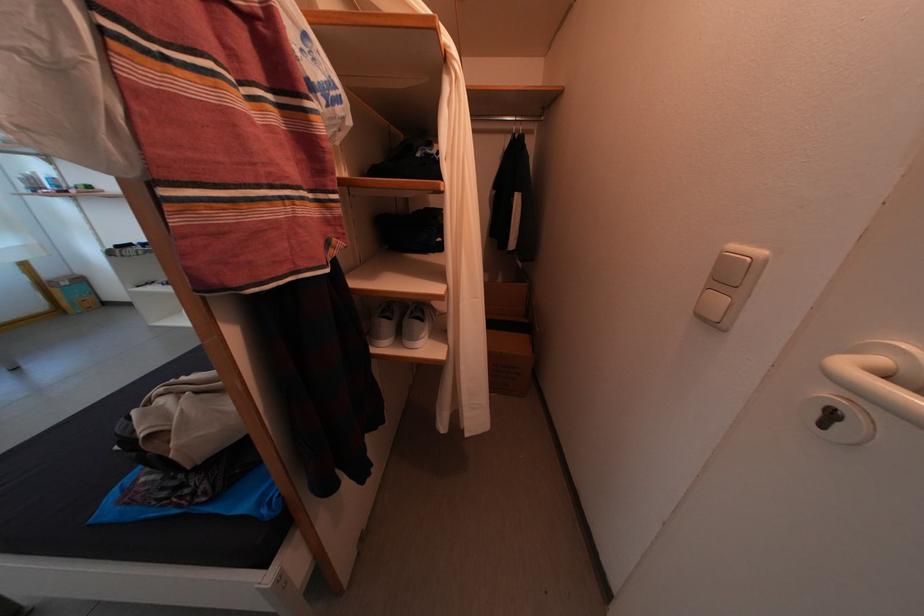
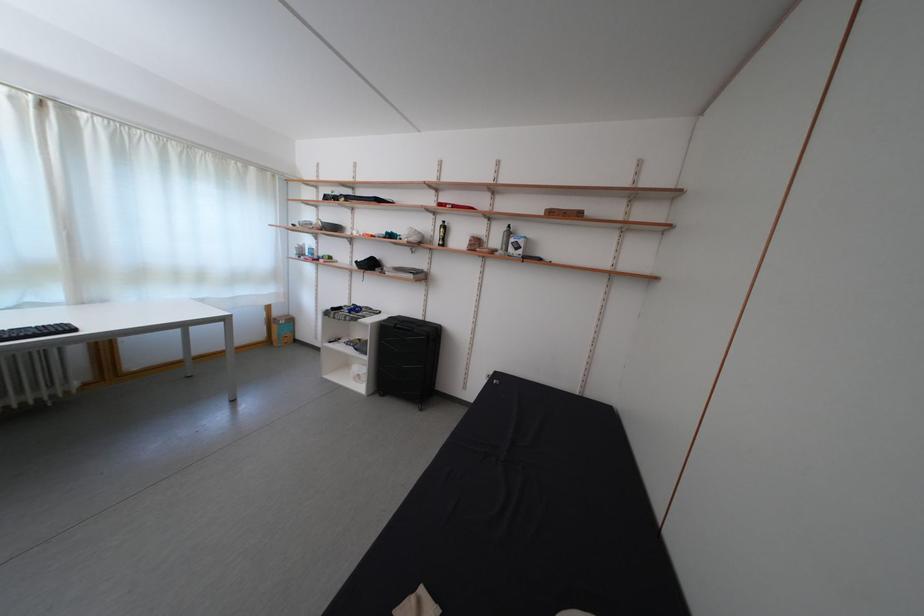
Question: What movement of the cameraman would produce the second image?

Choices:
 (A) Left
 (B) Right
 (C) Forward
 (D) Backward

Answer: (A)